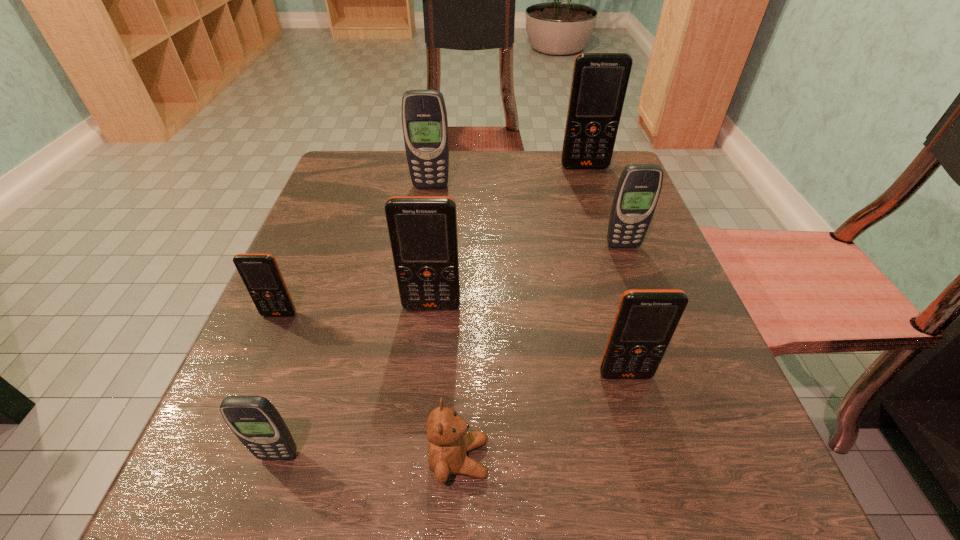
Where is `free space located on the screen of the leftmost orange cellular telephone`? free space located on the screen of the leftmost orange cellular telephone is located at coordinates (221, 450).

At what (x,y) coordinates should I click in order to perform the action: click on vacant space positioned 0.070m on the screen of the sixth cellular telephone from right to left. Please return your answer as a coordinate pair (x, y). The image size is (960, 540). Looking at the image, I should click on (257, 519).

Locate an element on the screen. This screenshot has width=960, height=540. vacant region located on the face of the teddy bear is located at coordinates (534, 458).

The width and height of the screenshot is (960, 540). I want to click on cellular telephone located in the near edge section of the desktop, so click(255, 421).

Find the location of `teddy bear that is at the near edge`. teddy bear that is at the near edge is located at coordinates (449, 441).

Identify the location of object that is at the near left corner. (255, 421).

Locate an element on the screen. Image resolution: width=960 pixels, height=540 pixels. object at the far right corner is located at coordinates (599, 83).

This screenshot has width=960, height=540. Identify the location of free space at the far edge. (481, 202).

In the image, there is a desktop. Where is `vacant space at the near edge`? The width and height of the screenshot is (960, 540). vacant space at the near edge is located at coordinates (326, 500).

What are the coordinates of `vacant area at the left edge` in the screenshot? It's located at (333, 207).